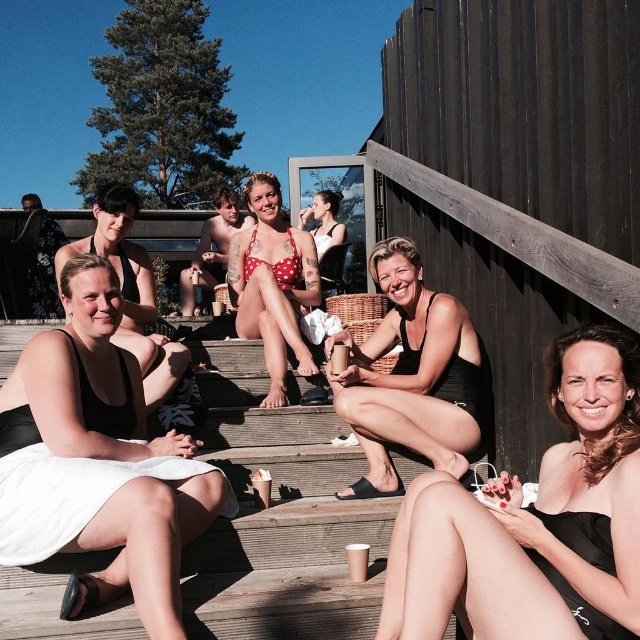
Question: Based on their relative distances, which object is nearer to the black matte swimsuit at lower right?

Choices:
 (A) black matte towel at lower left
 (B) black matte swimsuit at left

Answer: (A)

Question: From the image, what is the correct spatial relationship of black matte swimsuit at center in relation to polka dot bikini top at center?

Choices:
 (A) left
 (B) right

Answer: (B)

Question: Which object is farther from the camera taking this photo?

Choices:
 (A) polka dot bikini top at center
 (B) black matte swimsuit at lower right
 (C) black matte towel at lower left

Answer: (A)

Question: Does black matte swimsuit at lower right lie in front of black matte towel at lower left?

Choices:
 (A) yes
 (B) no

Answer: (A)

Question: Which of these objects is positioned closest to the black matte towel at lower left?

Choices:
 (A) black matte swimsuit at left
 (B) black matte swimsuit at center
 (C) black matte swimsuit at lower right

Answer: (A)

Question: Does black matte towel at lower left have a smaller size compared to black matte swimsuit at left?

Choices:
 (A) yes
 (B) no

Answer: (A)